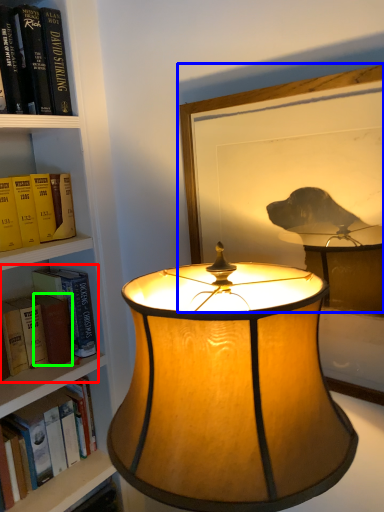
Question: Based on their relative distances, which object is farther from book (highlighted by a red box)? Choose from picture frame (highlighted by a blue box) and paperback book (highlighted by a green box).

Choices:
 (A) picture frame
 (B) paperback book

Answer: (A)